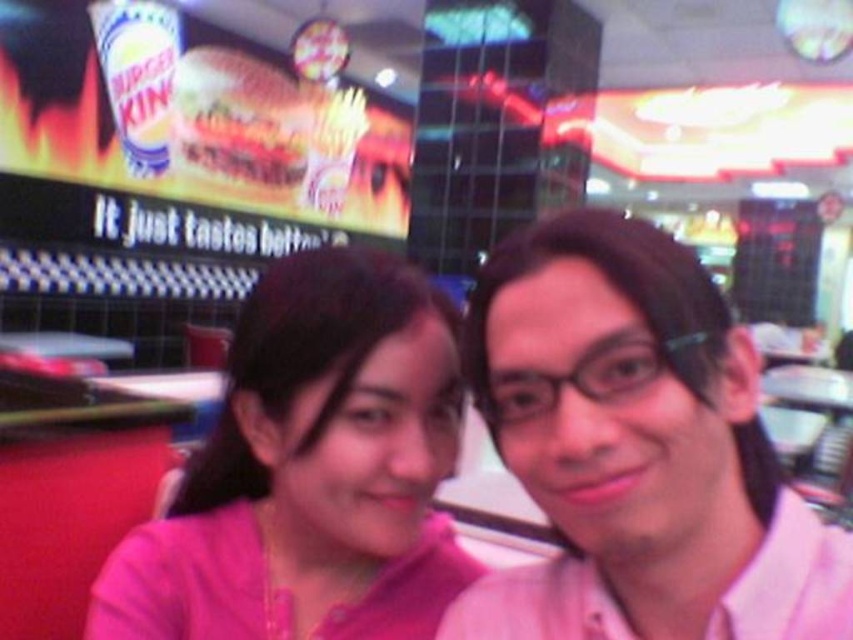
Does point (738, 502) come farther from viewer compared to point (358, 282)?

No.

Does point (599, 244) come behind point (224, 524)?

That is False.

Image resolution: width=853 pixels, height=640 pixels. I want to click on pink matte shirt at center, so click(x=637, y=449).